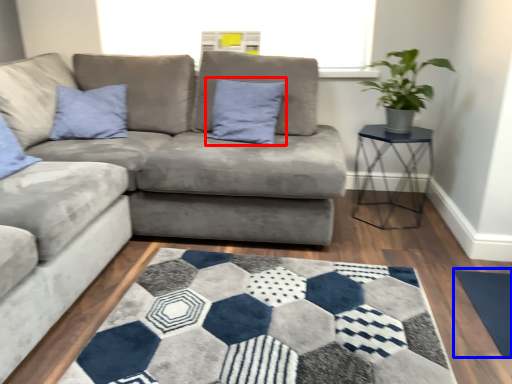
Question: Which object appears closest to the camera in this image, pillow (highlighted by a red box) or yoga mat (highlighted by a blue box)?

Choices:
 (A) pillow
 (B) yoga mat

Answer: (B)